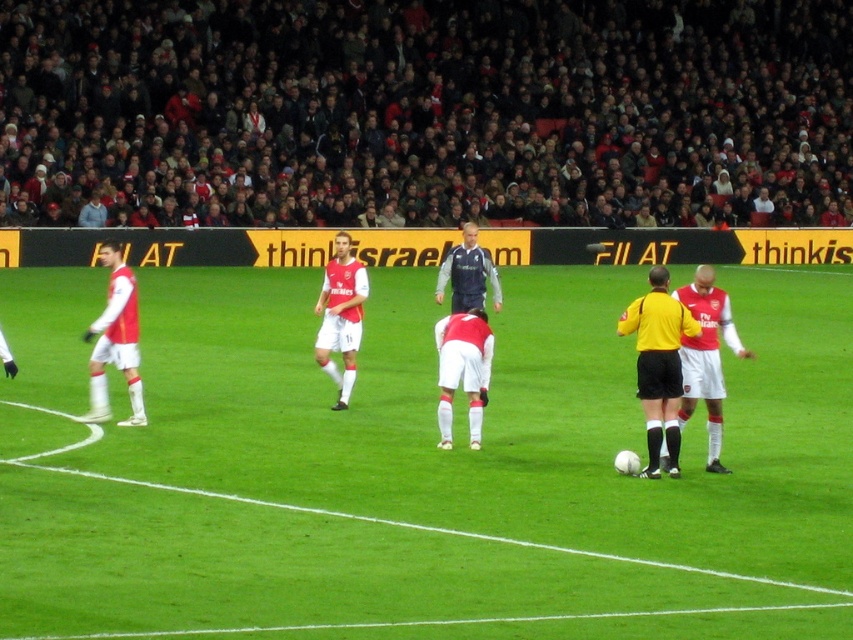
Consider the image. You are a soccer coach analyzing the field layout. The green grass field at center and the matte white jersey at center are both at the center of the image. Which one has a greater width?

The green grass field at center has a greater width than the matte white jersey at center, as stated in the description.